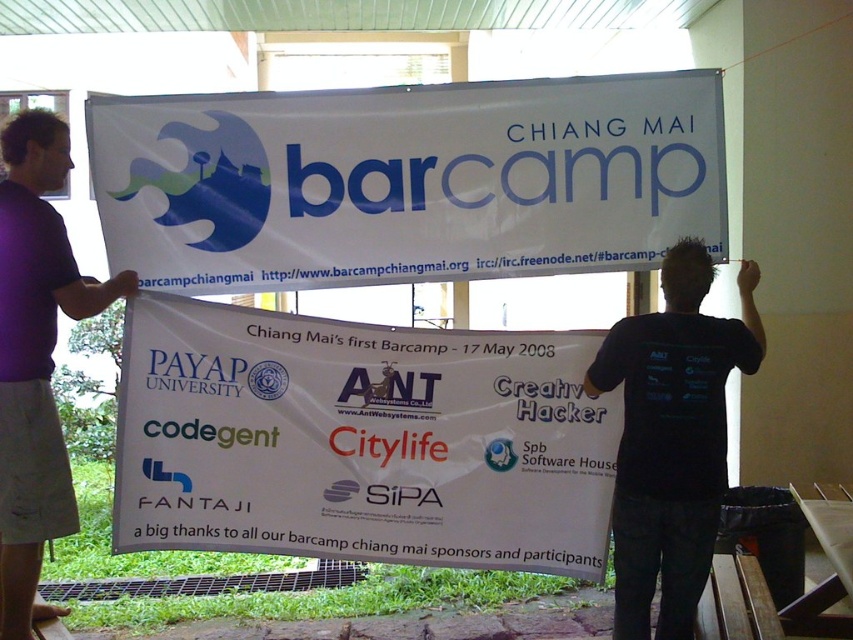
Question: Among these objects, which one is farthest from the camera?

Choices:
 (A) white paper banner at upper center
 (B) white paper banner at center
 (C) purple fabric shirt at left

Answer: (A)

Question: Observing the image, what is the correct spatial positioning of black fabric shirt at upper right in reference to purple fabric shirt at left?

Choices:
 (A) above
 (B) below

Answer: (B)

Question: Which object is farther from the camera taking this photo?

Choices:
 (A) purple fabric shirt at left
 (B) black fabric shirt at upper right
 (C) white paper banner at center

Answer: (C)

Question: Which object is farther from the camera taking this photo?

Choices:
 (A) white paper banner at center
 (B) black fabric shirt at upper right
 (C) purple fabric shirt at left

Answer: (A)

Question: Is white paper banner at upper center behind white paper banner at center?

Choices:
 (A) no
 (B) yes

Answer: (B)

Question: Is white paper banner at upper center below purple fabric shirt at left?

Choices:
 (A) no
 (B) yes

Answer: (A)